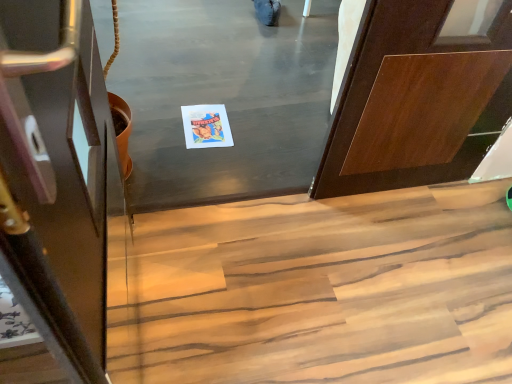
What do you see at coordinates (52, 185) in the screenshot? I see `shiny dark wood door at left` at bounding box center [52, 185].

Find the location of a particular element. The height and width of the screenshot is (384, 512). shiny dark wood door at left is located at coordinates (52, 185).

You are a GUI agent. You are given a task and a screenshot of the screen. Output one action in this format:
    pyautogui.click(x=<x>, y=<y>)
    Task: Click on the shiny dark wood door at left
    
    Given the screenshot: What is the action you would take?
    pyautogui.click(x=52, y=185)

Does point (189, 118) appear closer or farther from the camera than point (342, 351)?

Point (189, 118) appears to be farther away from the viewer than point (342, 351).

Identify the location of postcard that appears below the wooden stairs at lower center (from a real-world perspective). click(x=206, y=126).

From their relative heights in the image, would you say matte paper postcard at center is taller or shorter than wooden stairs at lower center?

Considering their sizes, matte paper postcard at center has less height than wooden stairs at lower center.

Measure the distance between matte paper postcard at center and wooden stairs at lower center.

28.42 inches.

Relative to shiny dark wood door at left, is wooden stairs at lower center in front or behind?

In the image, wooden stairs at lower center appears behind shiny dark wood door at left.

From the picture: From the image's perspective, does wooden stairs at lower center appear lower than shiny dark wood door at left?

Yes.

Can you confirm if wooden stairs at lower center is shorter than shiny dark wood door at left?

Yes.

Are wooden stairs at lower center and shiny dark wood door at left located far from each other?

No, wooden stairs at lower center is in close proximity to shiny dark wood door at left.

Which is more distant, (75, 320) or (250, 336)?

The point (250, 336) is behind.

Would you say shiny dark wood door at left is to the left or to the right of wooden stairs at lower center in the picture?

Clearly, shiny dark wood door at left is on the left of wooden stairs at lower center in the image.

Based on the photo, which is correct: shiny dark wood door at left is inside wooden stairs at lower center, or outside of it?

shiny dark wood door at left lies outside wooden stairs at lower center.

Does shiny dark wood door at left have a larger size compared to wooden stairs at lower center?

No, shiny dark wood door at left is not bigger than wooden stairs at lower center.

Is wooden stairs at lower center positioned far away from matte paper postcard at center?

wooden stairs at lower center is near matte paper postcard at center, not far away.

Is wooden stairs at lower center outside of matte paper postcard at center?

Yes.

From the image's perspective, is wooden stairs at lower center above or below matte paper postcard at center?

wooden stairs at lower center is situated lower than matte paper postcard at center in the image.

Is wooden stairs at lower center looking in the opposite direction of matte paper postcard at center?

Yes, matte paper postcard at center is at the back of wooden stairs at lower center.

Is matte paper postcard at center taller or shorter than shiny dark wood door at left?

Clearly, matte paper postcard at center is shorter compared to shiny dark wood door at left.

Who is bigger, matte paper postcard at center or shiny dark wood door at left?

Bigger between the two is shiny dark wood door at left.

Between shiny dark wood door at left and matte paper postcard at center, which one has smaller width?

matte paper postcard at center is thinner.

Can you confirm if shiny dark wood door at left is positioned to the right of matte paper postcard at center?

No, shiny dark wood door at left is not to the right of matte paper postcard at center.

What's the angular difference between shiny dark wood door at left and matte paper postcard at center's facing directions?

The angular difference between shiny dark wood door at left and matte paper postcard at center is 2.69 degrees.

Is point (42, 320) closer or farther from the camera than point (195, 136)?

Point (42, 320) appears to be closer to the viewer than point (195, 136).

Where is `stairs below the matte paper postcard at center (from the image's perspective)`? stairs below the matte paper postcard at center (from the image's perspective) is located at coordinates (321, 290).

You are a GUI agent. You are given a task and a screenshot of the screen. Output one action in this format:
    pyautogui.click(x=<x>, y=<y>)
    Task: Click on the stairs behind the shiny dark wood door at left
    
    Given the screenshot: What is the action you would take?
    pyautogui.click(x=321, y=290)

Considering their positions, is matte paper postcard at center positioned closer to shiny dark wood door at left than wooden stairs at lower center?

wooden stairs at lower center is positioned closer to the anchor shiny dark wood door at left.

From the picture: Considering their positions, is matte paper postcard at center positioned further to wooden stairs at lower center than shiny dark wood door at left?

Based on the image, shiny dark wood door at left appears to be further to wooden stairs at lower center.

Looking at the image, which one is located further to matte paper postcard at center, wooden stairs at lower center or shiny dark wood door at left?

The object further to matte paper postcard at center is shiny dark wood door at left.

Looking at the image, which one is located further to matte paper postcard at center, shiny dark wood door at left or wooden stairs at lower center?

Based on the image, shiny dark wood door at left appears to be further to matte paper postcard at center.

When comparing their distances from wooden stairs at lower center, does shiny dark wood door at left or matte paper postcard at center seem closer?

matte paper postcard at center is positioned closer to the anchor wooden stairs at lower center.

Looking at the image, which one is located closer to shiny dark wood door at left, wooden stairs at lower center or matte paper postcard at center?

wooden stairs at lower center is closer to shiny dark wood door at left.

The width and height of the screenshot is (512, 384). Find the location of `stairs between shiny dark wood door at left and matte paper postcard at center in the front-back direction`. stairs between shiny dark wood door at left and matte paper postcard at center in the front-back direction is located at coordinates (321, 290).